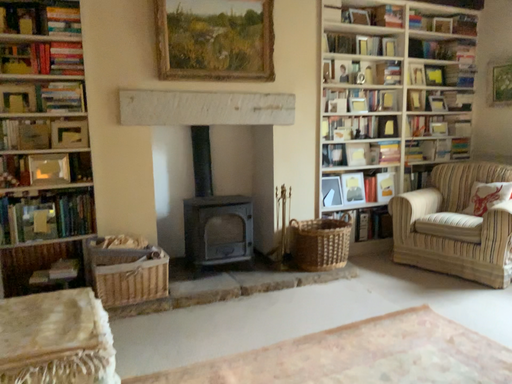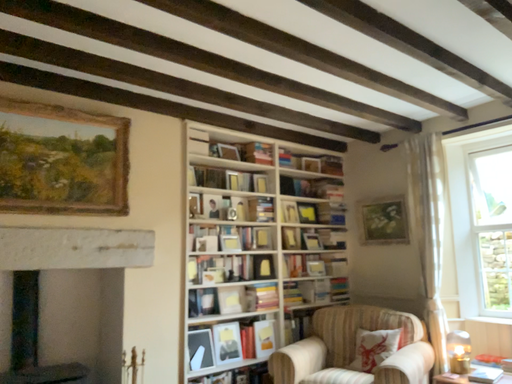
Question: How did the camera likely rotate when shooting the video?

Choices:
 (A) rotated downward
 (B) rotated upward

Answer: (B)